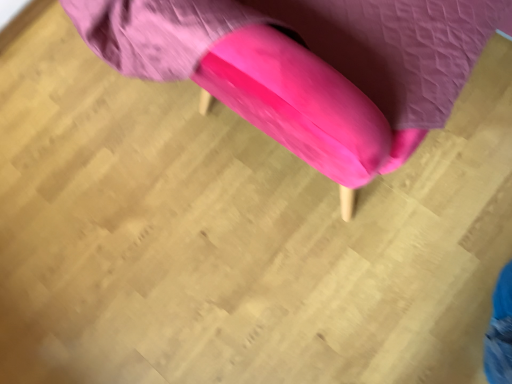
What do you see at coordinates (308, 66) in the screenshot?
I see `matte pink cushion at center` at bounding box center [308, 66].

Measure the distance between matte pink cushion at center and camera.

matte pink cushion at center and camera are 19.58 inches apart.

Where is `matte pink cushion at center`? The width and height of the screenshot is (512, 384). matte pink cushion at center is located at coordinates (308, 66).

This screenshot has width=512, height=384. What are the coordinates of `matte pink cushion at center` in the screenshot? It's located at (308, 66).